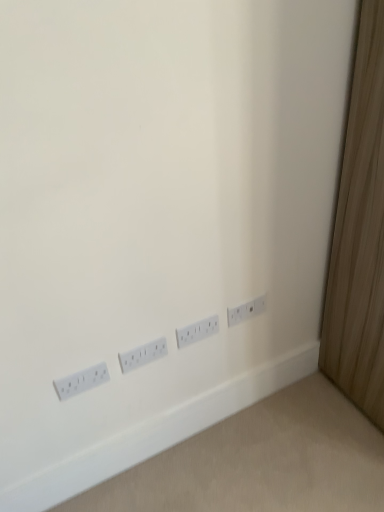
Question: From a real-world perspective, is white plastic power plugs and sockets at center, positioned as the second power plugs and sockets in left-to-right order, positioned over white plastic power plugs and sockets at lower right, which is counted as the 2th power plugs and sockets, starting from the right, based on gravity?

Choices:
 (A) yes
 (B) no

Answer: (B)

Question: Can you confirm if white plastic power plugs and sockets at center, marked as the third power plugs and sockets in a right-to-left arrangement, is wider than white plastic power plugs and sockets at lower right, which is counted as the 2th power plugs and sockets, starting from the right?

Choices:
 (A) yes
 (B) no

Answer: (B)

Question: Is white plastic power plugs and sockets at center, marked as the third power plugs and sockets in a right-to-left arrangement, looking in the opposite direction of white plastic power plugs and sockets at lower right, which is counted as the 2th power plugs and sockets, starting from the right?

Choices:
 (A) yes
 (B) no

Answer: (B)

Question: Does white plastic power plugs and sockets at center, marked as the third power plugs and sockets in a right-to-left arrangement, have a larger size compared to white plastic power plugs and sockets at lower right, which is counted as the 2th power plugs and sockets, starting from the right?

Choices:
 (A) yes
 (B) no

Answer: (B)

Question: From the image's perspective, is white plastic power plugs and sockets at center, marked as the third power plugs and sockets in a right-to-left arrangement, on white plastic power plugs and sockets at lower right, the 3th power plugs and sockets from the left?

Choices:
 (A) yes
 (B) no

Answer: (B)

Question: From a real-world perspective, is white plastic power plugs and sockets at lower left, the 1th power plugs and sockets in the left-to-right sequence, above or below white plastic power plugs and sockets at center, positioned as the second power plugs and sockets in left-to-right order?

Choices:
 (A) above
 (B) below

Answer: (A)

Question: Considering the positions of white plastic power plugs and sockets at lower left, the 1th power plugs and sockets in the left-to-right sequence, and white plastic power plugs and sockets at center, positioned as the second power plugs and sockets in left-to-right order, in the image, is white plastic power plugs and sockets at lower left, the 1th power plugs and sockets in the left-to-right sequence, wider or thinner than white plastic power plugs and sockets at center, positioned as the second power plugs and sockets in left-to-right order,?

Choices:
 (A) wide
 (B) thin

Answer: (B)

Question: Is point (82, 386) positioned closer to the camera than point (130, 351)?

Choices:
 (A) closer
 (B) farther

Answer: (A)

Question: Based on their sizes in the image, would you say white plastic power plugs and sockets at lower left, the fourth power plugs and sockets viewed from the right, is bigger or smaller than white plastic power plugs and sockets at center, marked as the third power plugs and sockets in a right-to-left arrangement?

Choices:
 (A) small
 (B) big

Answer: (A)

Question: Considering the positions of white plastic power plugs and sockets at center, marked as the third power plugs and sockets in a right-to-left arrangement, and white plastic power plugs and sockets at lower right, the first power plugs and sockets when ordered from right to left, in the image, is white plastic power plugs and sockets at center, marked as the third power plugs and sockets in a right-to-left arrangement, taller or shorter than white plastic power plugs and sockets at lower right, the first power plugs and sockets when ordered from right to left,?

Choices:
 (A) short
 (B) tall

Answer: (B)

Question: Choose the correct answer: Is white plastic power plugs and sockets at center, marked as the third power plugs and sockets in a right-to-left arrangement, inside white plastic power plugs and sockets at lower right, the first power plugs and sockets when ordered from right to left, or outside it?

Choices:
 (A) inside
 (B) outside

Answer: (B)

Question: From a real-world perspective, is white plastic power plugs and sockets at center, positioned as the second power plugs and sockets in left-to-right order, above or below white plastic power plugs and sockets at lower right, the first power plugs and sockets when ordered from right to left?

Choices:
 (A) above
 (B) below

Answer: (B)

Question: Looking at their shapes, would you say white plastic power plugs and sockets at center, positioned as the second power plugs and sockets in left-to-right order, is wider or thinner than white plastic power plugs and sockets at lower right, the first power plugs and sockets when ordered from right to left?

Choices:
 (A) wide
 (B) thin

Answer: (A)

Question: From a real-world perspective, relative to white plastic power plugs and sockets at lower left, the 1th power plugs and sockets in the left-to-right sequence, is white plastic power plugs and sockets at lower right, the fourth power plugs and sockets viewed from the left, vertically above or below?

Choices:
 (A) above
 (B) below

Answer: (A)

Question: Considering the positions of white plastic power plugs and sockets at lower right, the fourth power plugs and sockets viewed from the left, and white plastic power plugs and sockets at lower left, the 1th power plugs and sockets in the left-to-right sequence, in the image, is white plastic power plugs and sockets at lower right, the fourth power plugs and sockets viewed from the left, wider or thinner than white plastic power plugs and sockets at lower left, the 1th power plugs and sockets in the left-to-right sequence,?

Choices:
 (A) wide
 (B) thin

Answer: (B)